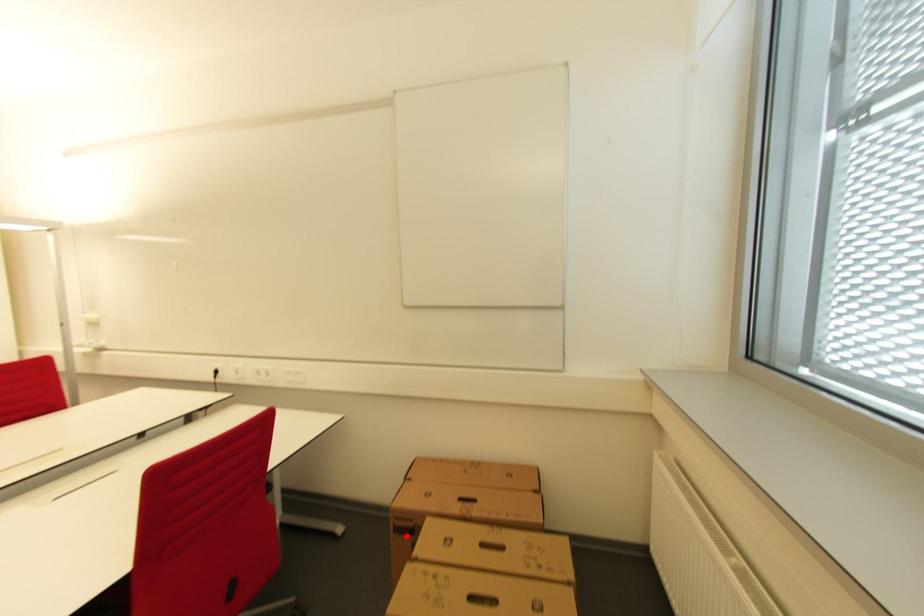
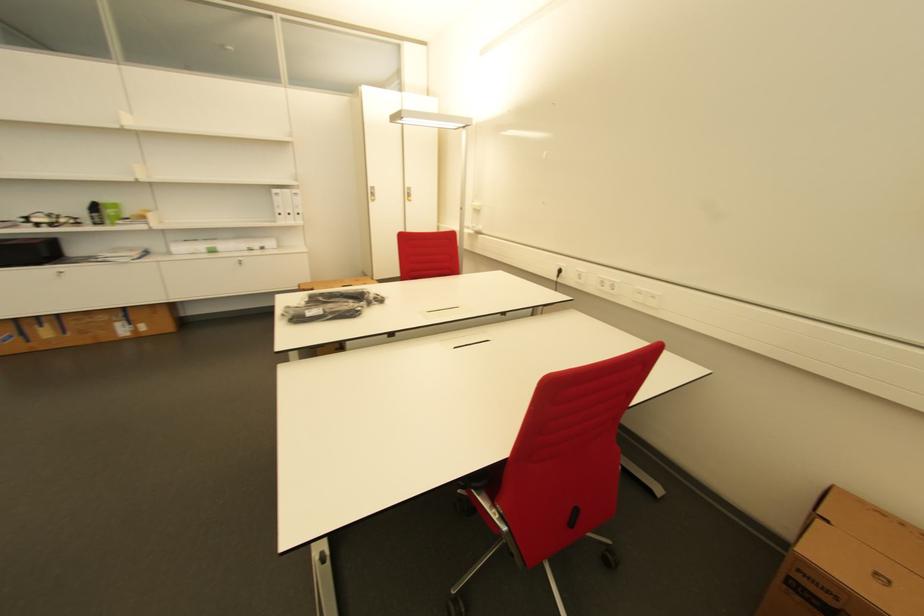
In the second image, find the point that corresponds to the highlighted location in the first image.

(805, 600)